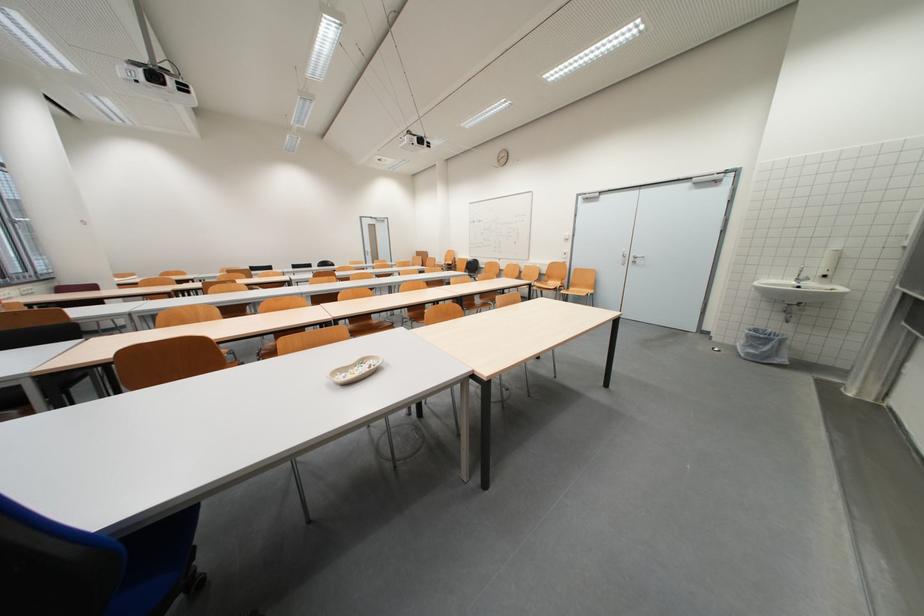
Describe the element at coordinates (636, 257) in the screenshot. I see `a silver door handle` at that location.